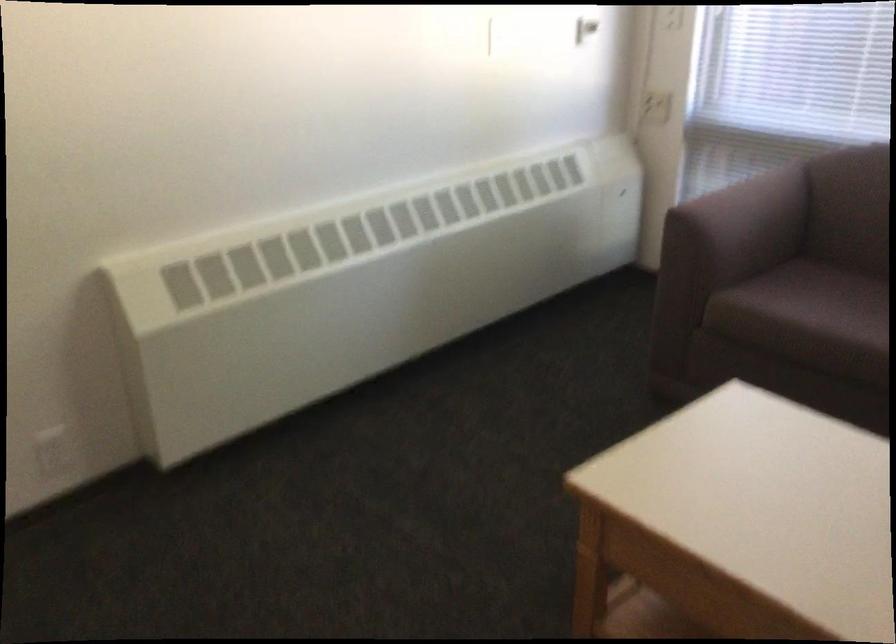
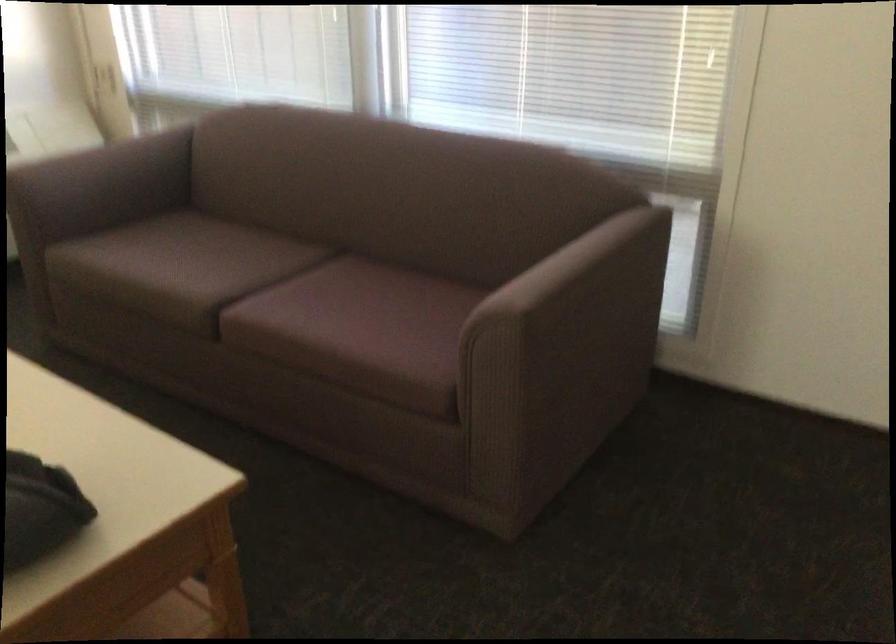
Where in the second image is the point corresponding to pixel 768 216 from the first image?

(113, 173)